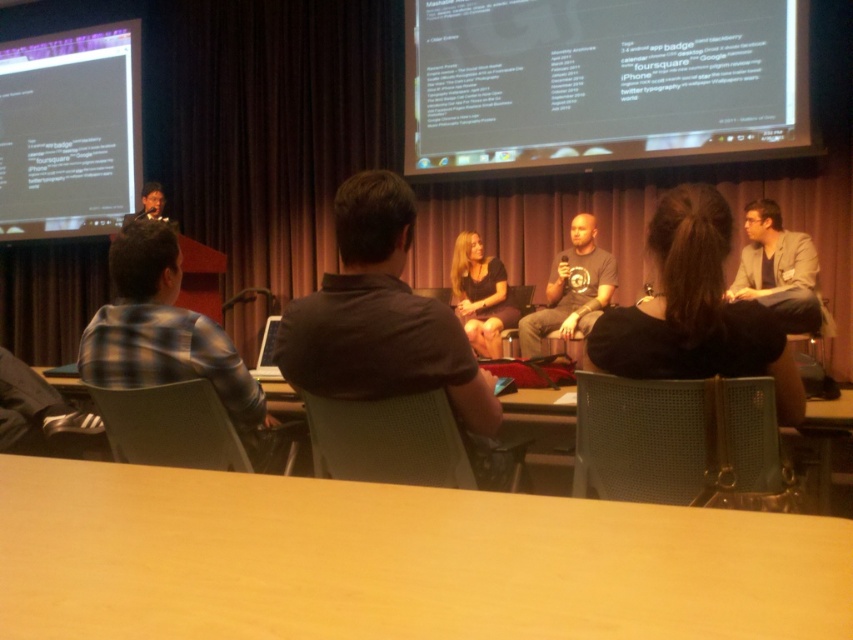
Question: Does light wood table at lower center appear over matte black screen at upper left?

Choices:
 (A) yes
 (B) no

Answer: (B)

Question: Can you confirm if matte black screen at upper left is bigger than plaid shirt at left?

Choices:
 (A) no
 (B) yes

Answer: (B)

Question: Which object is the farthest from the matte black screen at upper left?

Choices:
 (A) brown wood table at lower center
 (B) dark gray t-shirt at center
 (C) white matte text at upper right
 (D) plaid shirt at left

Answer: (A)

Question: Which of the following is the farthest from the observer?

Choices:
 (A) matte black screen at upper left
 (B) matte gray blazer at right
 (C) brown wood table at lower center

Answer: (A)

Question: Is matte gray blazer at right to the right of dark gray t-shirt at center from the viewer's perspective?

Choices:
 (A) yes
 (B) no

Answer: (A)

Question: Which point appears closest to the camera in this image?

Choices:
 (A) (53, 70)
 (B) (799, 563)
 (C) (764, 266)
 (D) (78, 372)

Answer: (B)